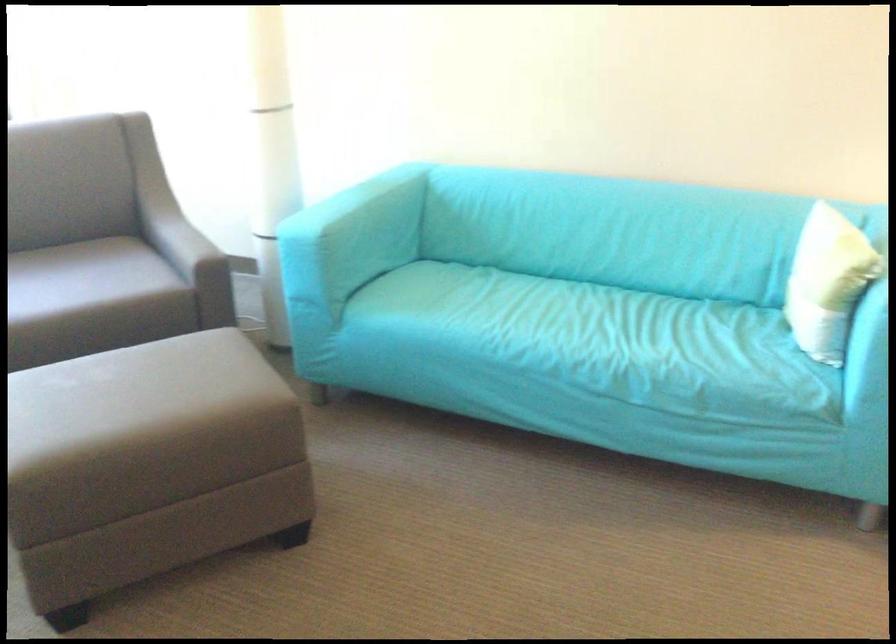
Where is `sofa armrest`? Image resolution: width=896 pixels, height=644 pixels. sofa armrest is located at coordinates (340, 242).